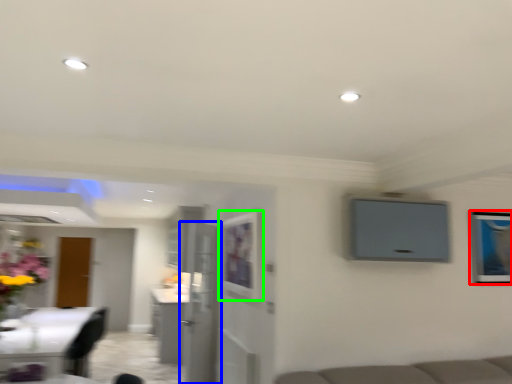
Question: Estimate the real-world distances between objects in this image. Which object is farther from picture frame (highlighted by a red box), door (highlighted by a blue box) or picture frame (highlighted by a green box)?

Choices:
 (A) door
 (B) picture frame

Answer: (A)